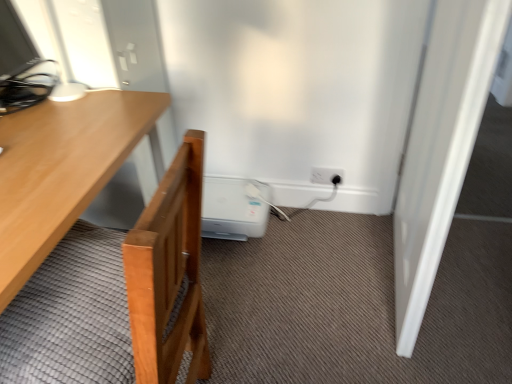
At what (x,y) coordinates should I click in order to perform the action: click on vacant area that is situated to the right of white smooth door at right. Please return your answer as a coordinate pair (x, y). Looking at the image, I should click on click(x=472, y=270).